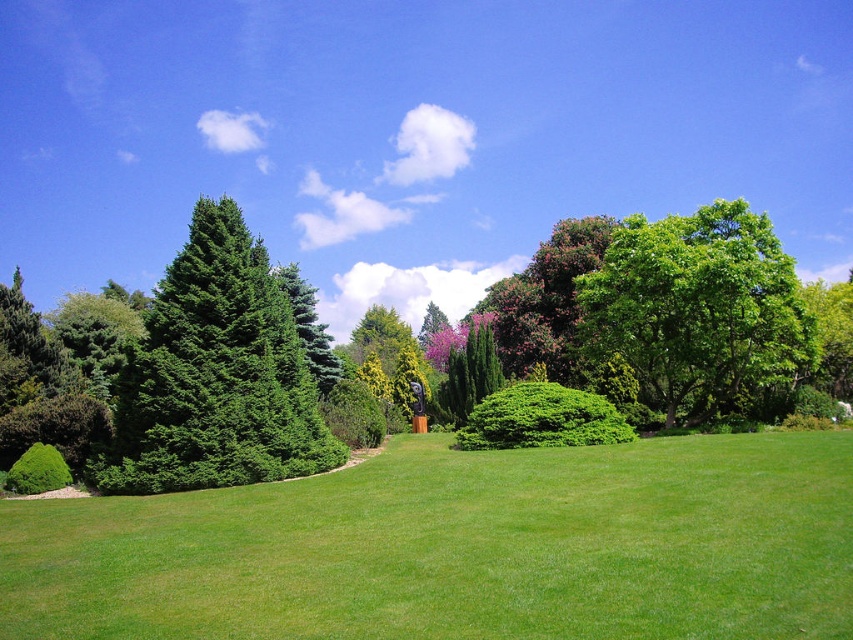
How much distance is there between green grass at center and green leafy bush at center?

green grass at center and green leafy bush at center are 30.81 feet apart.

Who is more distant from viewer, (434,634) or (590,406)?

Positioned behind is point (590,406).

Is point (450, 456) less distant than point (512, 397)?

That is True.

Where is `green grass at center`? green grass at center is located at coordinates (459, 547).

Does green grass at center have a smaller size compared to green glossy evergreen tree at left?

No.

Can you confirm if green grass at center is taller than green glossy evergreen tree at left?

In fact, green grass at center may be shorter than green glossy evergreen tree at left.

I want to click on green grass at center, so click(459, 547).

Is point (775, 634) positioned behind point (44, 474)?

That is False.

Does green grass at center appear under green leafy bush at lower left?

No.

The image size is (853, 640). What do you see at coordinates (459, 547) in the screenshot?
I see `green grass at center` at bounding box center [459, 547].

I want to click on green grass at center, so click(459, 547).